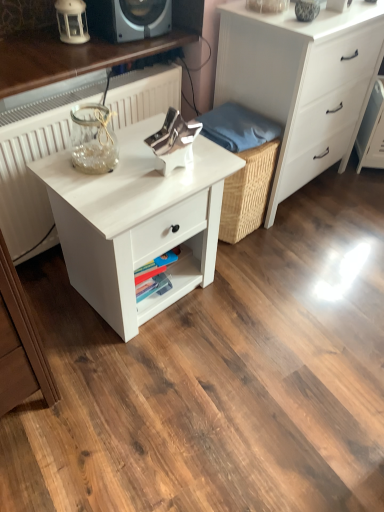
Question: Would you say white matte lantern at upper left contains blue fabric at center?

Choices:
 (A) no
 (B) yes

Answer: (A)

Question: Considering the relative positions of white matte lantern at upper left and blue fabric at center in the image provided, is white matte lantern at upper left to the right of blue fabric at center from the viewer's perspective?

Choices:
 (A) yes
 (B) no

Answer: (B)

Question: Considering the relative sizes of white matte lantern at upper left and blue fabric at center in the image provided, is white matte lantern at upper left shorter than blue fabric at center?

Choices:
 (A) no
 (B) yes

Answer: (A)

Question: Can you confirm if white matte lantern at upper left is smaller than blue fabric at center?

Choices:
 (A) no
 (B) yes

Answer: (B)

Question: Is white matte lantern at upper left located outside blue fabric at center?

Choices:
 (A) no
 (B) yes

Answer: (B)

Question: From the image's perspective, is white matte lantern at upper left over blue fabric at center?

Choices:
 (A) no
 (B) yes

Answer: (B)

Question: Are blue fabric at center and white textured radiator at left beside each other?

Choices:
 (A) yes
 (B) no

Answer: (B)

Question: Is blue fabric at center positioned far away from white textured radiator at left?

Choices:
 (A) no
 (B) yes

Answer: (A)

Question: Is blue fabric at center wider than white textured radiator at left?

Choices:
 (A) no
 (B) yes

Answer: (A)

Question: Is white textured radiator at left located within blue fabric at center?

Choices:
 (A) no
 (B) yes

Answer: (A)

Question: Does blue fabric at center lie in front of white textured radiator at left?

Choices:
 (A) yes
 (B) no

Answer: (B)

Question: From a real-world perspective, is blue fabric at center under white textured radiator at left?

Choices:
 (A) yes
 (B) no

Answer: (B)

Question: Does white textured radiator at left appear on the left side of white matte lantern at upper left?

Choices:
 (A) no
 (B) yes

Answer: (B)